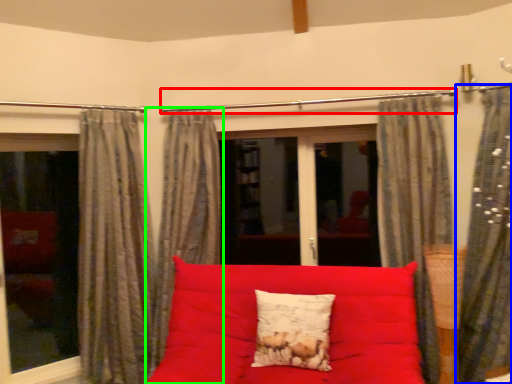
Question: Estimate the real-world distances between objects in this image. Which object is closer to clothesline (highlighted by a red box), curtain (highlighted by a blue box) or curtain (highlighted by a green box)?

Choices:
 (A) curtain
 (B) curtain

Answer: (B)